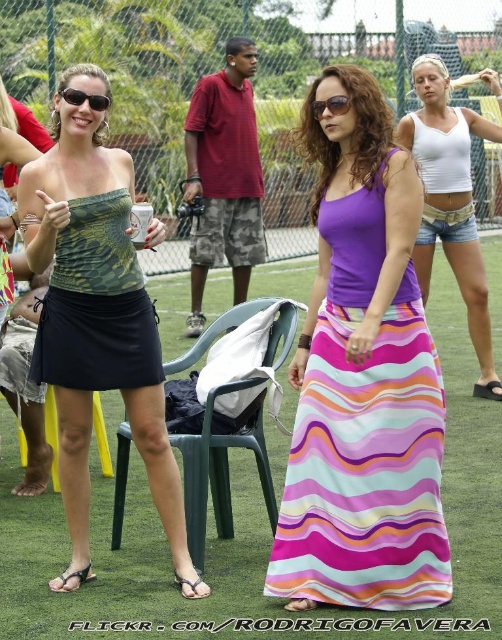
Does matte green tube top at left have a lesser width compared to sunglasses at center?

No.

Between point (170, 540) and point (335, 96), which one is positioned in front?

Point (335, 96) is more forward.

Find the location of a particular element. matte green tube top at left is located at coordinates (96, 317).

Is point (39, 380) in front of point (438, 64)?

Yes, it is.

You are a GUI agent. You are given a task and a screenshot of the screen. Output one action in this format:
    pyautogui.click(x=<x>, y=<y>)
    Task: Click on the matte green tube top at left
    The height and width of the screenshot is (640, 502).
    Given the screenshot: What is the action you would take?
    pyautogui.click(x=96, y=317)

Who is higher up, camouflage fabric skirt at center or white cotton tank top at center?

white cotton tank top at center

Is camouflage fabric skirt at center in front of white cotton tank top at center?

Yes, camouflage fabric skirt at center is closer to the viewer.

Where is `camouflage fabric skirt at center`? camouflage fabric skirt at center is located at coordinates (96, 305).

This screenshot has height=640, width=502. Find the location of `camouflage fabric skirt at center`. camouflage fabric skirt at center is located at coordinates (96, 305).